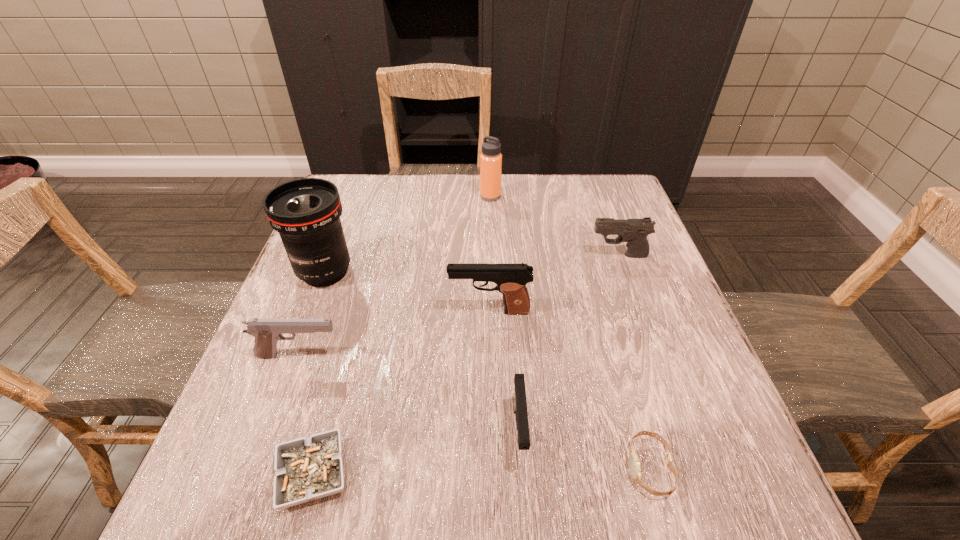
Locate an element on the screen. This screenshot has height=540, width=960. watch is located at coordinates (634, 463).

At what (x,y) coordinates should I click in order to perform the action: click on ashtray. Please return your answer as a coordinate pair (x, y). Looking at the image, I should click on (307, 469).

You are a GUI agent. You are given a task and a screenshot of the screen. Output one action in this format:
    pyautogui.click(x=<x>, y=<y>)
    Task: Click on the free spot located 0.350m on the back of the telephoto lens
    The image size is (960, 540).
    Given the screenshot: What is the action you would take?
    pyautogui.click(x=360, y=179)

Where is `free space located 0.180m on the front of the farthest object`? free space located 0.180m on the front of the farthest object is located at coordinates coord(492,241).

Where is `free space located 0.110m at the barrel of the third nearest pistol`? free space located 0.110m at the barrel of the third nearest pistol is located at coordinates (398, 311).

Identify the location of vacant space situated at the barrel of the third nearest pistol. The image size is (960, 540). (334, 311).

At what (x,y) coordinates should I click in order to perform the action: click on vacant area located 0.150m at the barrel of the third nearest pistol. Please return your answer as a coordinate pair (x, y). This screenshot has height=540, width=960. Looking at the image, I should click on (380, 311).

Where is `vacant space located at the barrel of the rightmost pistol`? This screenshot has width=960, height=540. vacant space located at the barrel of the rightmost pistol is located at coordinates (431, 255).

The width and height of the screenshot is (960, 540). Find the location of `free spot located 0.240m at the barrel of the rightmost pistol`. free spot located 0.240m at the barrel of the rightmost pistol is located at coordinates 492,255.

What are the coordinates of `free spot located at the barrel of the rightmost pistol` in the screenshot? It's located at (549, 255).